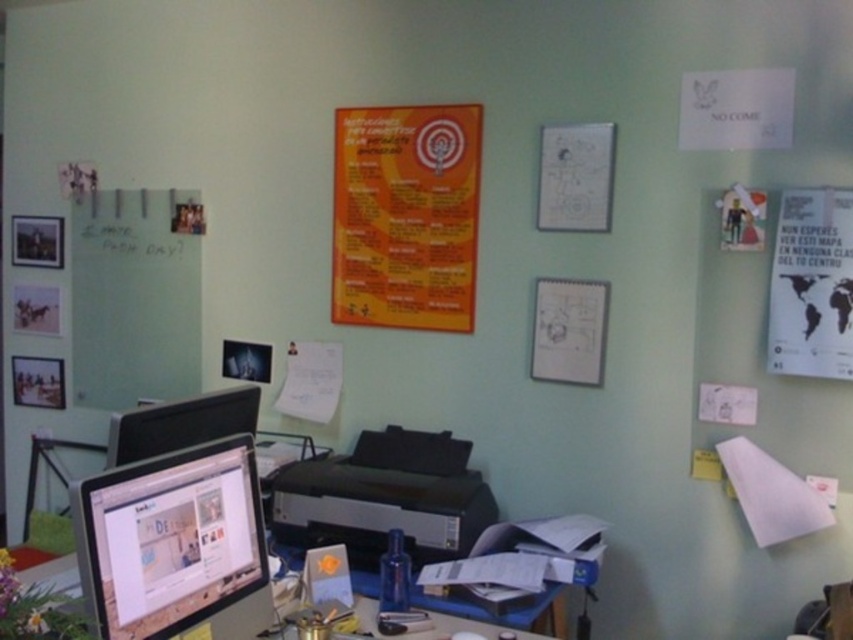
You are organizing a presentation and need to know which of the two items is narrower so you can fit it into a narrow binder. Which is narrower between the white paper map at right and the white paper drawing at upper center?

The white paper map at right is thinner than the white paper drawing at upper center, so the white paper map at right is narrower and can fit into the narrow binder.

In the scene shown: You are organizing the office wall and need to hang both the orange paper poster at upper center and the black plastic printer at center. Which object should be placed higher to maintain the current spatial relationship?

The orange paper poster at upper center should be placed higher since it has a greater height compared to the black plastic printer at center.

You are an office worker who needs to print a document. You see the orange paper poster at upper center and the black plastic printer at center. Which object is closer to you?

The orange paper poster at upper center is closer to you because it is further to the viewer than the black plastic printer at center.